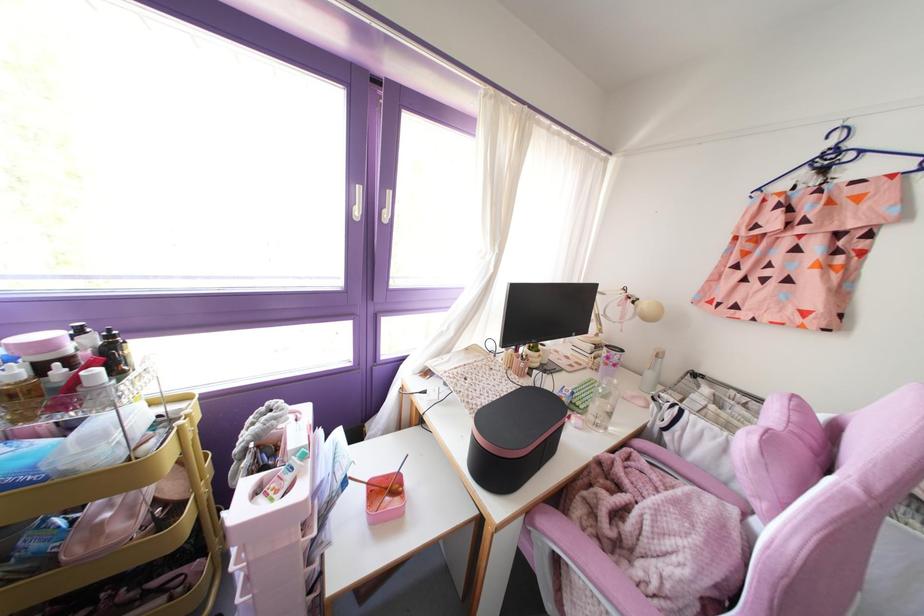
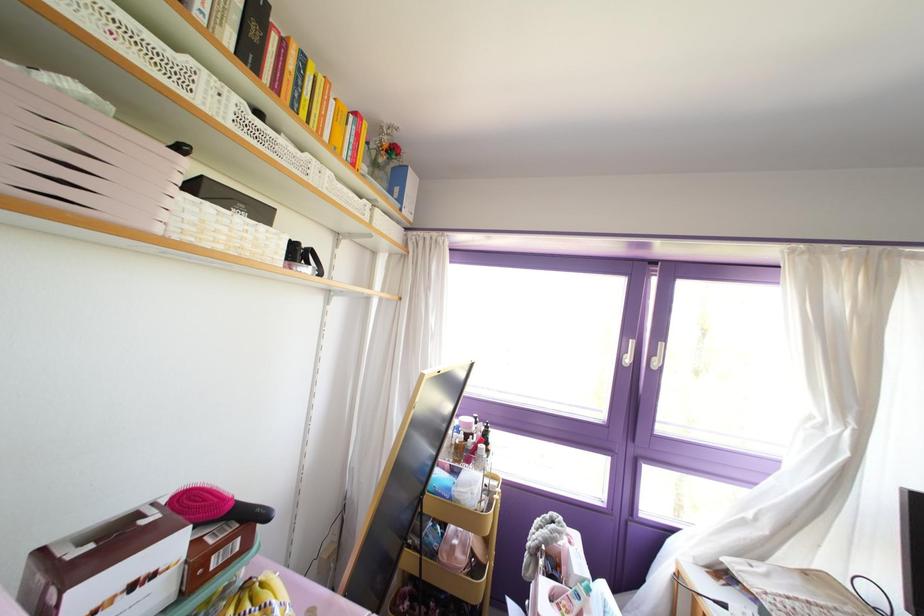
In the second image, find the point that corresponds to the point at 357,212 in the first image.

(626, 360)